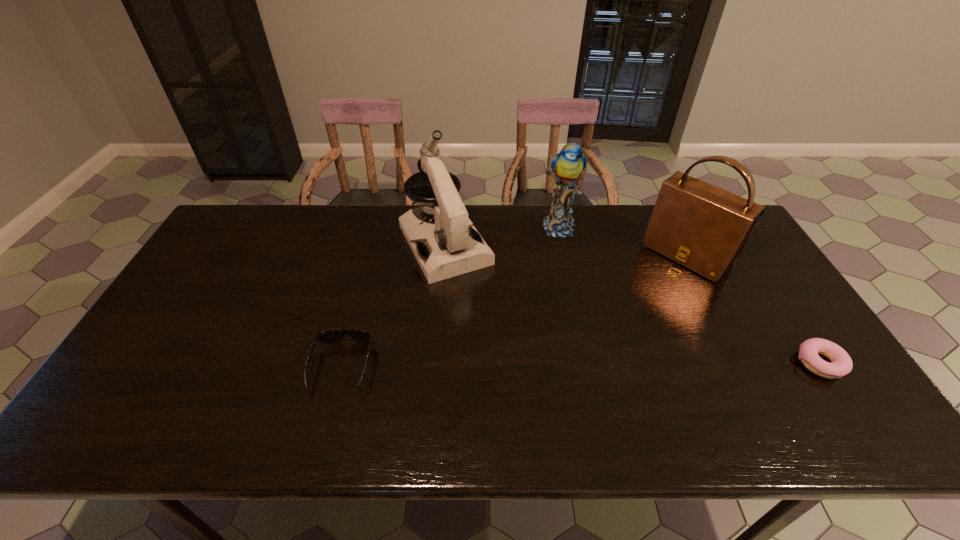
Locate an element on the screen. The width and height of the screenshot is (960, 540). vacant space in between the microscope and the shoulder bag is located at coordinates (566, 250).

The image size is (960, 540). I want to click on empty space that is in between the sunglasses and the third object from right to left, so click(450, 296).

In order to click on empty location between the parrot and the microscope in this screenshot , I will do `click(501, 236)`.

I want to click on vacant region between the rightmost object and the microscope, so click(x=633, y=305).

Image resolution: width=960 pixels, height=540 pixels. Find the location of `vacant space that is in between the second object from right to left and the shortest object`. vacant space that is in between the second object from right to left and the shortest object is located at coordinates (754, 309).

Locate an element on the screen. This screenshot has height=540, width=960. free space between the shortest object and the third object from left to right is located at coordinates (688, 295).

Identify the location of vacant area that lies between the shoulder bag and the parrot. This screenshot has height=540, width=960. (622, 241).

Where is `free space between the microscope and the shortest object`? free space between the microscope and the shortest object is located at coordinates (633, 305).

Find the location of `vacant region between the sunglasses and the third object from left to right`. vacant region between the sunglasses and the third object from left to right is located at coordinates (450, 296).

At what (x,y) coordinates should I click in order to perform the action: click on vacant area that lies between the microscope and the doughnut. Please return your answer as a coordinate pair (x, y). The image size is (960, 540). Looking at the image, I should click on pyautogui.click(x=633, y=305).